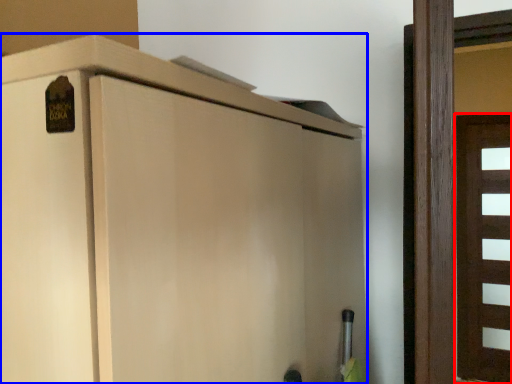
Question: Among these objects, which one is nearest to the camera, door (highlighted by a red box) or cupboard (highlighted by a blue box)?

Choices:
 (A) door
 (B) cupboard

Answer: (B)